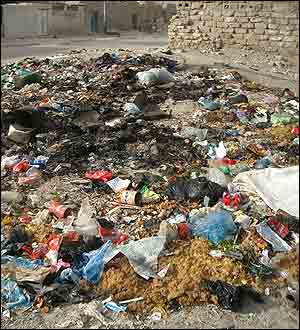
Where is `green trash`? This screenshot has height=330, width=300. green trash is located at coordinates (31, 77).